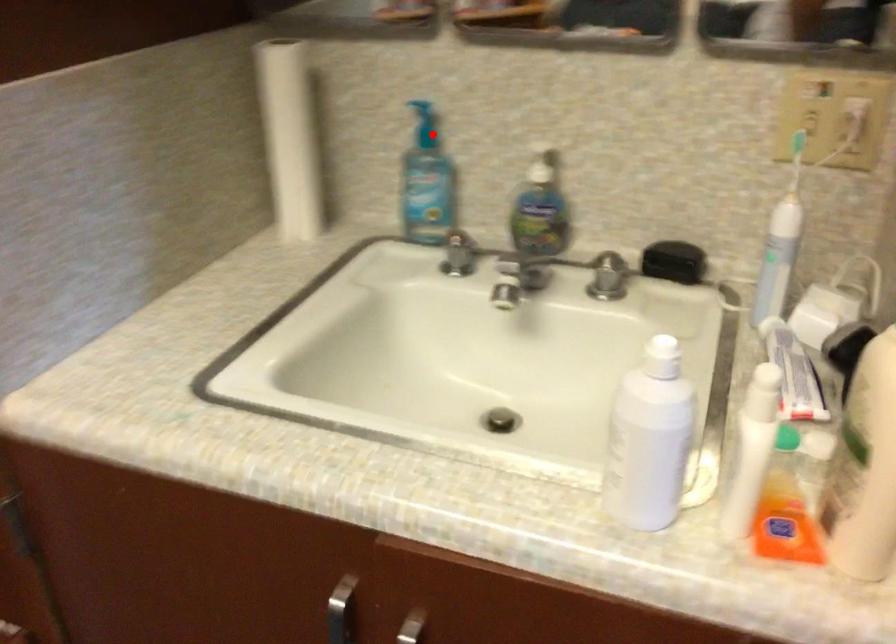
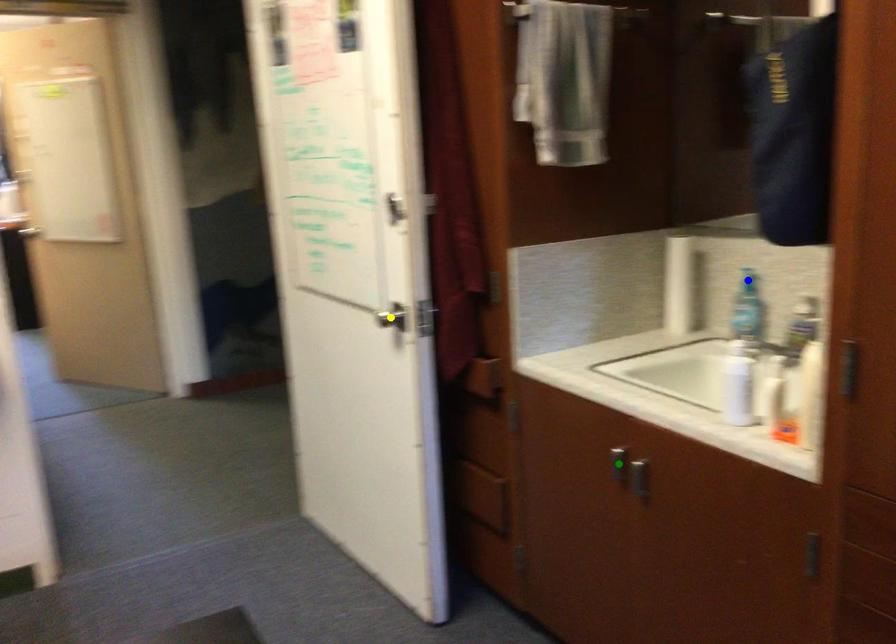
Question: I am providing you with two images of the same scene from different viewpoints. A red point is marked on the first image. You are given multiple points on the second image. Which point in image 2 represents the same 3d spot as the red point in image 1?

Choices:
 (A) yellow point
 (B) green point
 (C) blue point

Answer: (C)